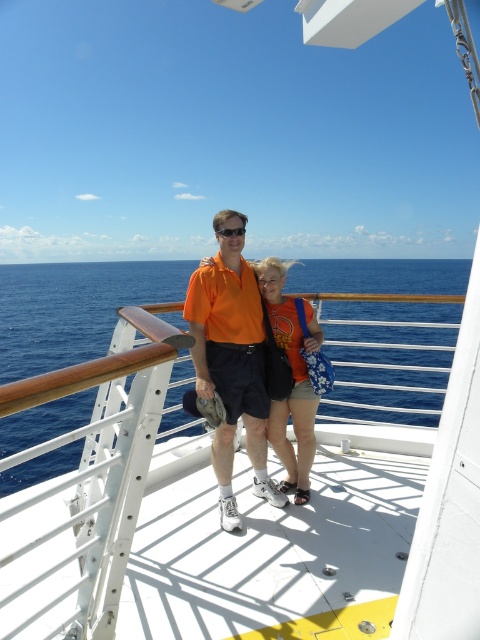
You are a photographer on the cruise ship deck. You need to capture a photo of the orange matte shirt at center and the black plastic goggles at center. The camera has a minimum focus distance of 1 meter. Will you be able to take a clear photo of both objects without moving either?

The distance between the orange matte shirt at center and the black plastic goggles at center is 88.61 centimeters, which is less than the camera minimum focus distance of 1 meter. Therefore, you cannot take a clear photo of both objects without moving them closer together.